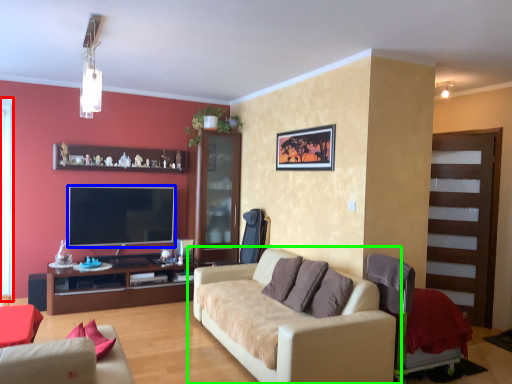
Question: Based on their relative distances, which object is farther from window screen (highlighted by a red box)? Choose from television (highlighted by a blue box) and studio couch (highlighted by a green box).

Choices:
 (A) television
 (B) studio couch

Answer: (B)